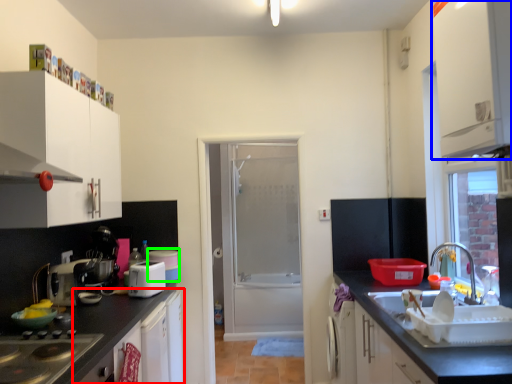
Question: Which object is positioned closest to cabinetry (highlighted by a red box)? Select from cabinetry (highlighted by a blue box) and appliance (highlighted by a green box).

Choices:
 (A) cabinetry
 (B) appliance

Answer: (B)